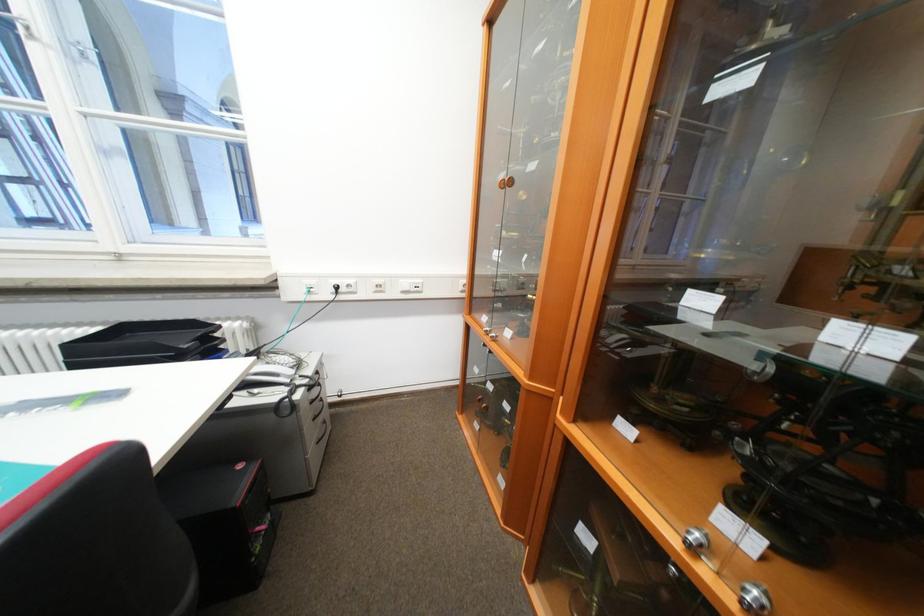
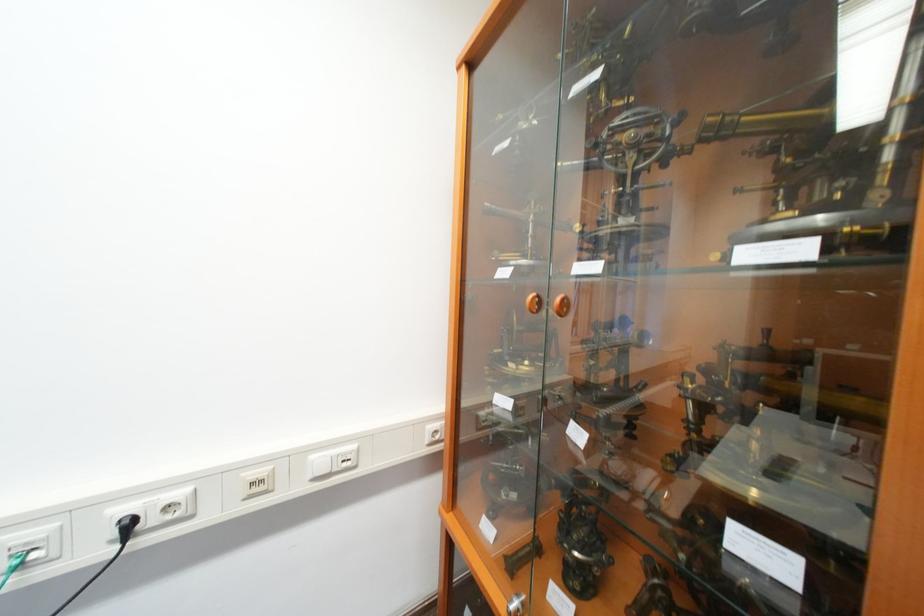
Find the pixel in the second image that matches the point at 386,286 in the first image.

(261, 485)